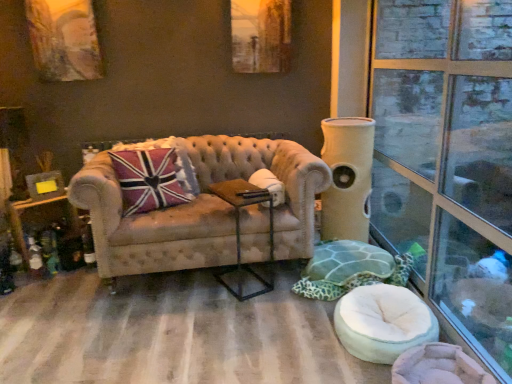
Question: Considering the relative sizes of white fabric swivel chair at lower right, placed as the second swivel chair when sorted from back to front, and beige fabric cat tower at right in the image provided, is white fabric swivel chair at lower right, placed as the second swivel chair when sorted from back to front, taller than beige fabric cat tower at right?

Choices:
 (A) yes
 (B) no

Answer: (B)

Question: Considering the relative positions of white fabric swivel chair at lower right, placed as the second swivel chair when sorted from back to front, and beige fabric cat tower at right in the image provided, is white fabric swivel chair at lower right, placed as the second swivel chair when sorted from back to front, to the right of beige fabric cat tower at right from the viewer's perspective?

Choices:
 (A) no
 (B) yes

Answer: (A)

Question: Is white fabric swivel chair at lower right, placed as the second swivel chair when sorted from back to front, surrounding beige fabric cat tower at right?

Choices:
 (A) yes
 (B) no

Answer: (B)

Question: Is white fabric swivel chair at lower right, placed as the second swivel chair when sorted from back to front, located outside beige fabric cat tower at right?

Choices:
 (A) no
 (B) yes

Answer: (B)

Question: Is white fabric swivel chair at lower right, placed as the second swivel chair when sorted from back to front, at the left side of beige fabric cat tower at right?

Choices:
 (A) yes
 (B) no

Answer: (A)

Question: Considering the relative positions of white fabric swivel chair at lower right, which is the 1th swivel chair from front to back, and beige fabric cat tower at right in the image provided, is white fabric swivel chair at lower right, which is the 1th swivel chair from front to back, behind beige fabric cat tower at right?

Choices:
 (A) no
 (B) yes

Answer: (A)

Question: Can you confirm if beige fabric cat tower at right is positioned to the right of white fabric swivel chair at lower right, which is the 1th swivel chair from front to back?

Choices:
 (A) yes
 (B) no

Answer: (A)

Question: Is beige fabric cat tower at right smaller than white fabric swivel chair at lower right, placed as the second swivel chair when sorted from back to front?

Choices:
 (A) yes
 (B) no

Answer: (B)

Question: Is beige fabric cat tower at right positioned behind white fabric swivel chair at lower right, which is the 1th swivel chair from front to back?

Choices:
 (A) yes
 (B) no

Answer: (A)

Question: Is beige fabric cat tower at right touching white fabric swivel chair at lower right, placed as the second swivel chair when sorted from back to front?

Choices:
 (A) no
 (B) yes

Answer: (A)

Question: Is white fabric swivel chair at lower right, which is the 1th swivel chair from front to back, located within beige fabric cat tower at right?

Choices:
 (A) yes
 (B) no

Answer: (B)

Question: Is beige fabric cat tower at right to the left of white fabric swivel chair at lower right, which is the 1th swivel chair from front to back, from the viewer's perspective?

Choices:
 (A) no
 (B) yes

Answer: (A)

Question: Is tufted beige couch at center positioned in front of green fabric swivel chair at lower right, which is the first swivel chair from back to front?

Choices:
 (A) yes
 (B) no

Answer: (A)